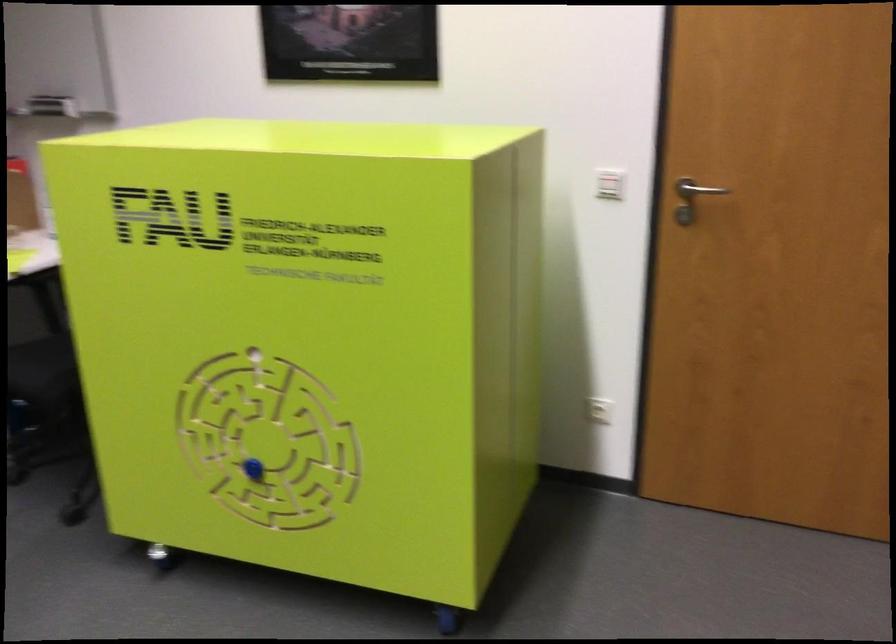
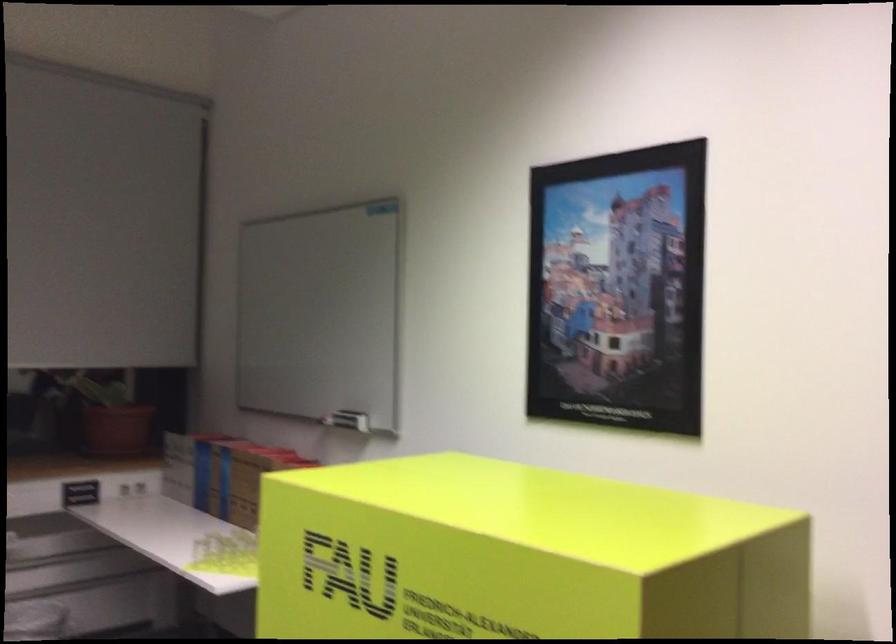
Based on the continuous images, in which direction is the camera rotating?

The rotation direction of the camera is left-up.